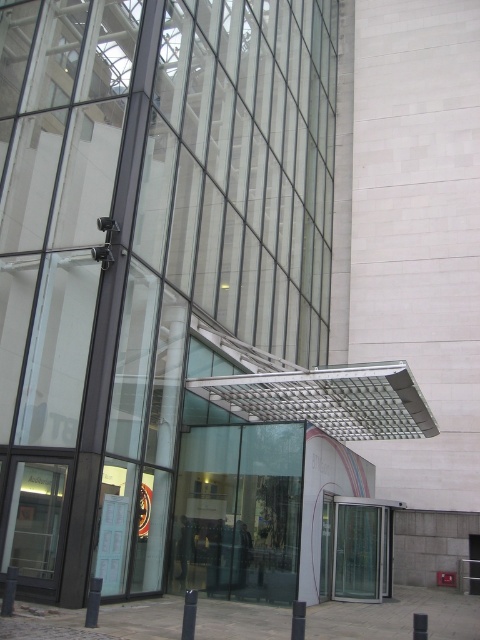
You are standing in front of the modern building and want to enter through the transparent glass door at center. However, there is a transparent glass door at lower center in your path. How far apart are these two doors?

The transparent glass door at center is 12.76 feet away from the transparent glass door at lower center, so the distance between them is 12.76 feet.